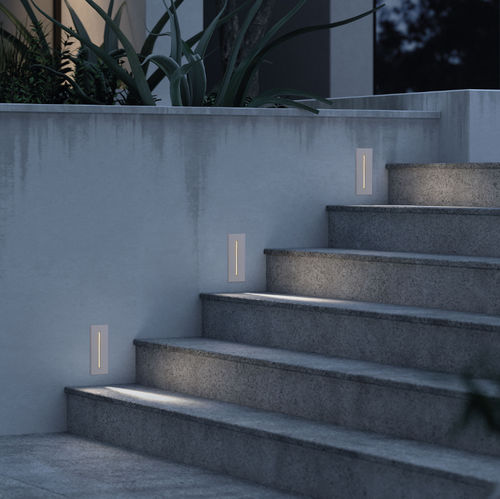
This screenshot has height=499, width=500. I want to click on lights, so click(x=101, y=345), click(x=235, y=257), click(x=363, y=172).